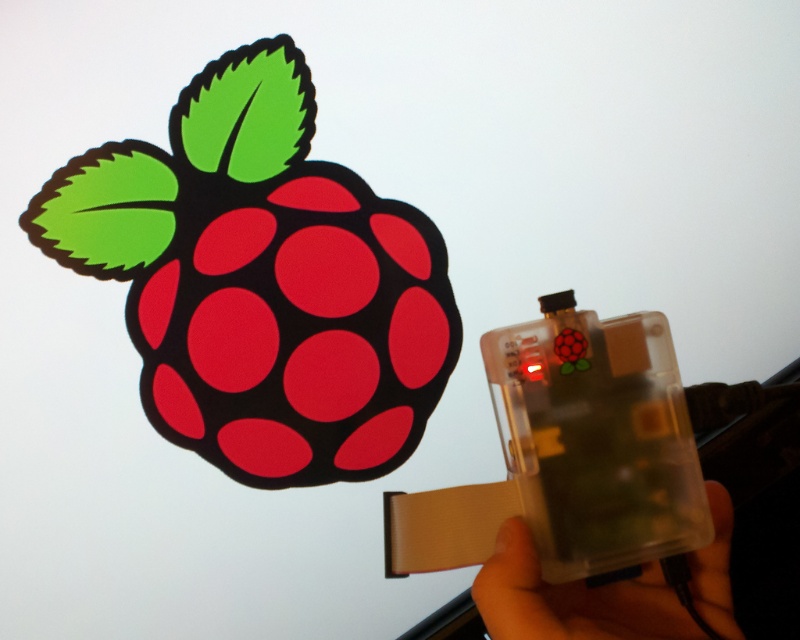
You are designing a poster and need to ensure that the matte plastic raspberry at upper left and the clear plastic hand at lower right are visible from a distance. Based on their sizes, which object should be placed closer to the viewer to maintain visibility?

The matte plastic raspberry at upper left has a greater height compared to the clear plastic hand at lower right. To maintain visibility from a distance, the clear plastic hand at lower right should be placed closer to the viewer since it is smaller and needs to be enlarged in the poster design.

You are a technician who needs to connect the clear plastic hand at lower right to the matte plastic raspberry at upper left using a cable that is 30 centimeters long. Can you do it without extending the cable?

The matte plastic raspberry at upper left and clear plastic hand at lower right are 36.12 centimeters apart from each other. The cable is only 30 centimeters long, so it is not long enough to reach. You would need a longer cable to make the connection.

You are a technician inspecting the Raspberry Pi setup. You notice the matte plastic raspberry at upper left and the clear plastic hand at lower right. Based on their positions, which object is closer to the top edge of the screen?

The matte plastic raspberry at upper left is closer to the top edge of the screen because it is located above the clear plastic hand at lower right.